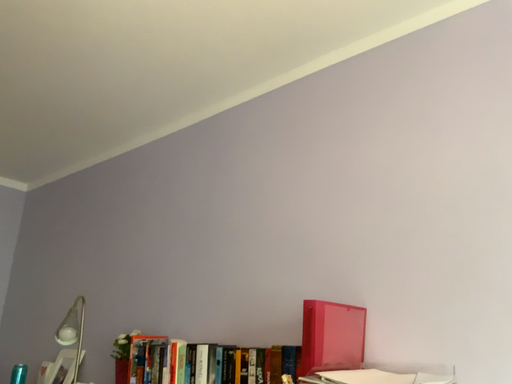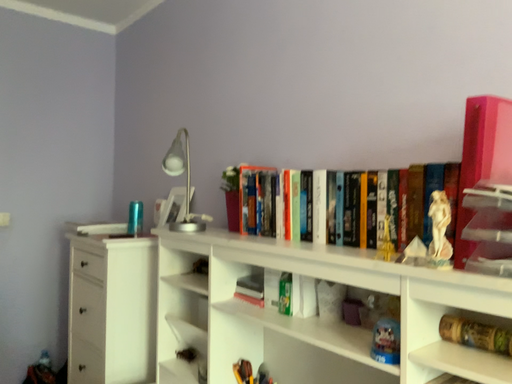
Question: How did the camera likely rotate when shooting the video?

Choices:
 (A) rotated downward
 (B) rotated upward

Answer: (A)